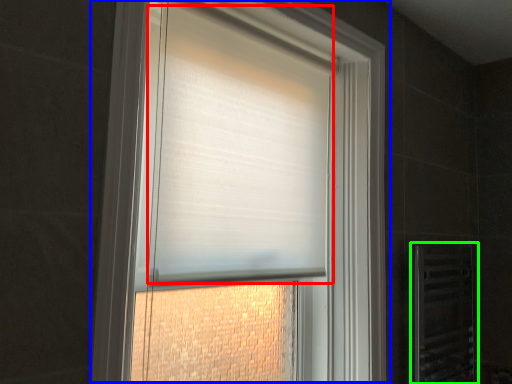
Question: Considering the real-world distances, which object is farthest from blind (highlighted by a red box)? window (highlighted by a blue box) or screen door (highlighted by a green box)?

Choices:
 (A) window
 (B) screen door

Answer: (B)